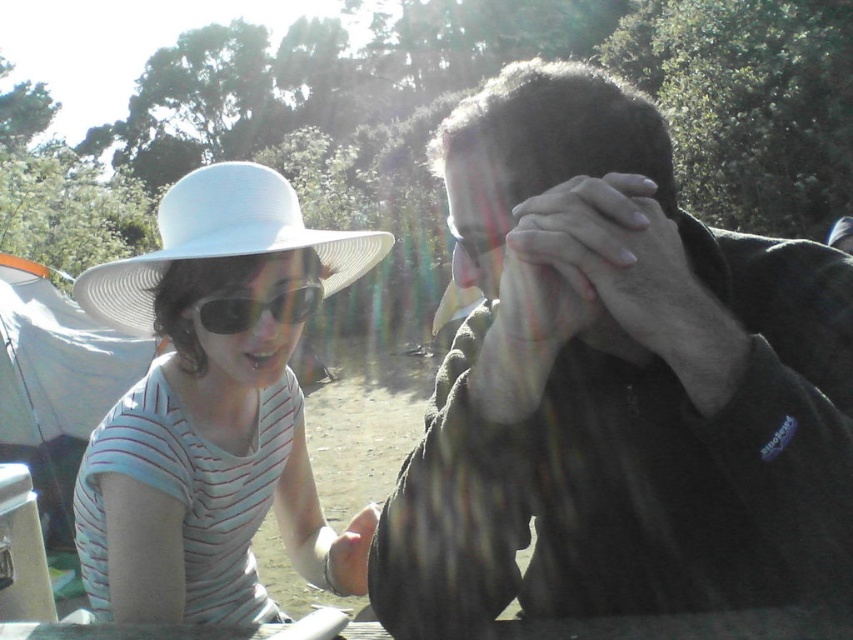
Who is taller, matte white hat at left or matte black sunglasses at left?

matte white hat at left is taller.

Can you confirm if matte white hat at left is wider than matte black sunglasses at left?

Yes.

Where is `matte white hat at left`? This screenshot has height=640, width=853. matte white hat at left is located at coordinates (250, 317).

Image resolution: width=853 pixels, height=640 pixels. Find the location of `matte white hat at left`. matte white hat at left is located at coordinates (250, 317).

Is point (132, 435) farther from camera compared to point (202, 304)?

Yes, it is.

Is point (91, 596) positioned in front of point (289, 305)?

No, it is behind (289, 305).

You are a GUI agent. You are given a task and a screenshot of the screen. Output one action in this format:
    pyautogui.click(x=<x>, y=<y>)
    Task: Click on the white matte hat at left
    This screenshot has height=640, width=853.
    Given the screenshot: What is the action you would take?
    pyautogui.click(x=213, y=406)

Is dark green fleece at center bigger than smooth skin hands at center?

Yes, dark green fleece at center is bigger than smooth skin hands at center.

Can you confirm if dark green fleece at center is positioned to the right of smooth skin hands at center?

Incorrect, dark green fleece at center is not on the right side of smooth skin hands at center.

Does point (802, 288) come closer to viewer compared to point (566, 180)?

No, (802, 288) is further to viewer.

Locate an element on the screen. dark green fleece at center is located at coordinates (621, 390).